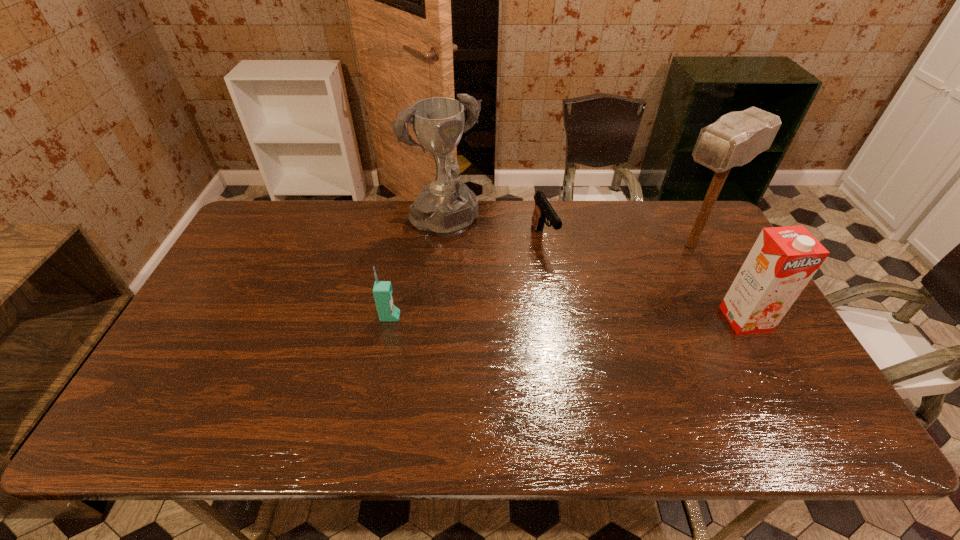
You are a GUI agent. You are given a task and a screenshot of the screen. Output one action in this format:
    pyautogui.click(x=<x>, y=<y>)
    Task: Click on the cellular telephone
    The image size is (960, 540).
    Given the screenshot: What is the action you would take?
    pyautogui.click(x=382, y=290)

The image size is (960, 540). I want to click on carton, so click(783, 260).

Identify the location of mallet. (736, 138).

This screenshot has height=540, width=960. I want to click on pistol, so click(x=543, y=210).

Locate an element on the screen. the third object from right to left is located at coordinates (543, 210).

This screenshot has height=540, width=960. Identify the location of award. pos(447,207).

Identify the location of vacant position located 0.130m on the keypad of the fourth tallest object. The image size is (960, 540). (447, 317).

You are a GUI agent. You are given a task and a screenshot of the screen. Output one action in this format:
    pyautogui.click(x=<x>, y=<y>)
    Task: Click on the free space located on the back of the third tallest object
    
    Given the screenshot: What is the action you would take?
    pyautogui.click(x=708, y=252)

This screenshot has width=960, height=540. I want to click on vacant area situated above the head of the mallet, so click(587, 305).

Where is `free space located above the head of the mallet`? free space located above the head of the mallet is located at coordinates (607, 293).